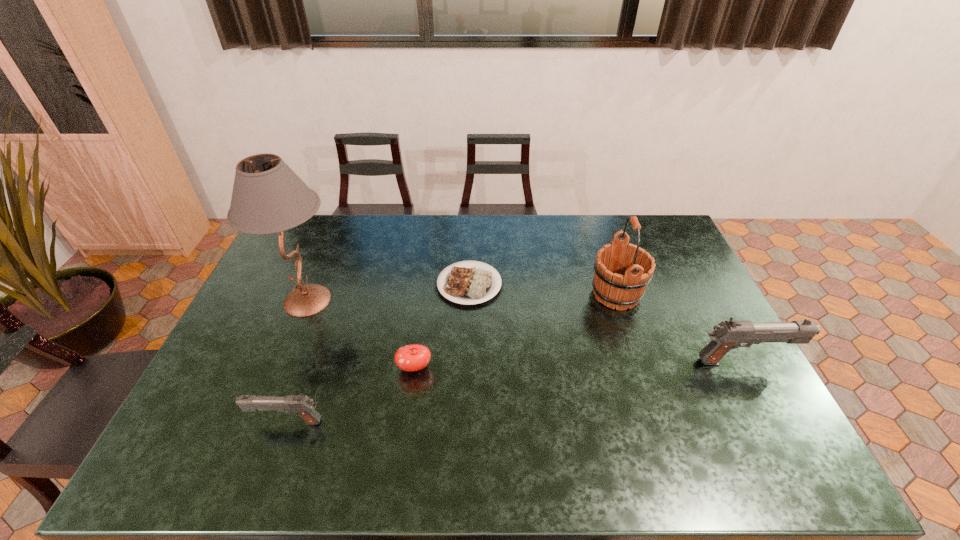
Where is `the left gun`? the left gun is located at coordinates (302, 405).

Find the location of `the nearer gun`. the nearer gun is located at coordinates (302, 405).

Locate an element on the screen. The height and width of the screenshot is (540, 960). the farther gun is located at coordinates (727, 335).

Find the location of a particular element. the rightmost object is located at coordinates (727, 335).

Where is `the tallest object`? The height and width of the screenshot is (540, 960). the tallest object is located at coordinates (268, 197).

You are a GUI agent. You are given a task and a screenshot of the screen. Output one action in this format:
    pyautogui.click(x=<x>, y=<y>)
    Task: Click on the plate
    This screenshot has width=960, height=540.
    Given the screenshot: What is the action you would take?
    pyautogui.click(x=469, y=285)

At what (x,y) coordinates should I click in order to perform the action: click on apple. Please return your answer as a coordinate pair (x, y). Looking at the image, I should click on (415, 357).

Identify the location of the fifth shortest object. (616, 286).

Locate an element on the screen. wine bucket is located at coordinates (616, 286).

The image size is (960, 540). I want to click on free space located 0.090m in the direction the left gun is aimed, so click(x=215, y=422).